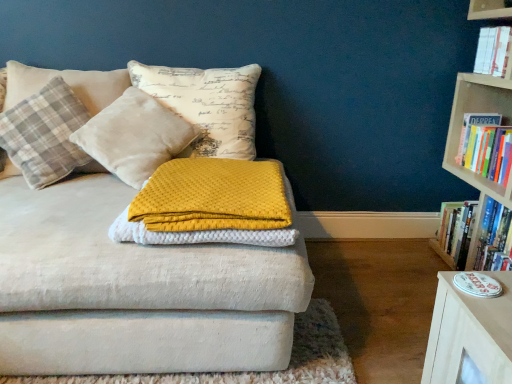
What do you see at coordinates (462, 127) in the screenshot?
I see `wooden bookcase at right` at bounding box center [462, 127].

This screenshot has width=512, height=384. What are the coordinates of `white paper book at upper right, the first book from the top` in the screenshot? It's located at (493, 50).

The image size is (512, 384). Describe the element at coordinates (493, 50) in the screenshot. I see `white paper book at upper right, the third book positioned from the bottom` at that location.

What do you see at coordinates (134, 136) in the screenshot? I see `velvet cushion at upper left, which is the 2th pillow from left to right` at bounding box center [134, 136].

You are a GUI agent. You are given a task and a screenshot of the screen. Output one action in this format:
    pyautogui.click(x=<x>, y=<y>)
    Task: Click on the plaid fabric pillow at left, which appears as the second pillow when viewed from the right
    
    Given the screenshot: What is the action you would take?
    pyautogui.click(x=45, y=134)

This screenshot has height=384, width=512. Find the location of `hardcover book at right, marked as the 2th book in a top-to-bottom arrangement`. hardcover book at right, marked as the 2th book in a top-to-bottom arrangement is located at coordinates (486, 146).

Visually, is yellow textured blanket at center positioned to the left or to the right of hardcover book at right, marked as the 2th book in a top-to-bottom arrangement?

yellow textured blanket at center is positioned on hardcover book at right, marked as the 2th book in a top-to-bottom arrangement,'s left side.

Can you confirm if yellow textured blanket at center is smaller than hardcover book at right, the second book from the bottom?

No.

Based on the photo, which object is closer to the camera, hardcover book at right, marked as the 2th book in a top-to-bottom arrangement, or yellow textured blanket at center?

yellow textured blanket at center is closer to the camera.

Considering the points (501, 156) and (199, 240), which point is in front, point (501, 156) or point (199, 240)?

Point (199, 240)

Locate an element on the screen. The height and width of the screenshot is (384, 512). the 2nd book behind the yellow textured blanket at center is located at coordinates (486, 146).

From a real-world perspective, who is located higher, hardcover book at right, marked as the 2th book in a top-to-bottom arrangement, or yellow textured blanket at center?

hardcover book at right, marked as the 2th book in a top-to-bottom arrangement, from a real-world perspective.

Considering the positions of objects yellow textured blanket at center and wooden bookcase at right in the image provided, who is more to the left, yellow textured blanket at center or wooden bookcase at right?

From the viewer's perspective, yellow textured blanket at center appears more on the left side.

Is yellow textured blanket at center facing away from wooden bookcase at right?

No, yellow textured blanket at center is not facing away from wooden bookcase at right.

Looking at this image, from the image's perspective, is yellow textured blanket at center above or below wooden bookcase at right?

yellow textured blanket at center is situated lower than wooden bookcase at right in the image.

From a real-world perspective, which is physically below, yellow textured blanket at center or wooden bookcase at right?

yellow textured blanket at center, from a real-world perspective.

Considering the sizes of white paper book at upper right, the first book from the top, and wooden bookcase at right in the image, is white paper book at upper right, the first book from the top, bigger or smaller than wooden bookcase at right?

In the image, white paper book at upper right, the first book from the top, appears to be smaller than wooden bookcase at right.

From the image's perspective, relative to wooden bookcase at right, is white paper book at upper right, the third book positioned from the bottom, above or below?

Clearly, from the image's perspective, white paper book at upper right, the third book positioned from the bottom, is above wooden bookcase at right.

Based on their positions, is white paper book at upper right, the third book positioned from the bottom, located to the left or right of wooden bookcase at right?

In the image, white paper book at upper right, the third book positioned from the bottom, appears on the right side of wooden bookcase at right.

Between white paper book at upper right, the first book from the top, and wooden bookcase at right, which one has smaller width?

white paper book at upper right, the first book from the top.

From the image's perspective, which object appears higher, velvet cushion at upper left, which is the 2th pillow from left to right, or hardcover book at right, which appears as the 1th book when ordered from the bottom?

velvet cushion at upper left, which is the 2th pillow from left to right, from the image's perspective.

Considering the sizes of objects velvet cushion at upper left, which is the 2th pillow from left to right, and hardcover book at right, which appears as the 1th book when ordered from the bottom, in the image provided, who is taller, velvet cushion at upper left, which is the 2th pillow from left to right, or hardcover book at right, which appears as the 1th book when ordered from the bottom,?

velvet cushion at upper left, which is the 2th pillow from left to right.

Would you say velvet cushion at upper left, which is the 2th pillow from left to right, is inside or outside hardcover book at right, placed as the third book when sorted from top to bottom?

velvet cushion at upper left, which is the 2th pillow from left to right, lies outside hardcover book at right, placed as the third book when sorted from top to bottom.

Based on the photo, choose the correct answer: Is plaid fabric pillow at left, which is the first pillow from left to right, inside white paper book at upper right, the first book from the top, or outside it?

plaid fabric pillow at left, which is the first pillow from left to right, lies outside white paper book at upper right, the first book from the top.

Is plaid fabric pillow at left, which appears as the second pillow when viewed from the right, positioned before white paper book at upper right, the first book from the top?

Yes, plaid fabric pillow at left, which appears as the second pillow when viewed from the right, is closer to the viewer.

From a real-world perspective, is plaid fabric pillow at left, which appears as the second pillow when viewed from the right, located beneath white paper book at upper right, the third book positioned from the bottom?

Indeed, from a real-world perspective, plaid fabric pillow at left, which appears as the second pillow when viewed from the right, is positioned beneath white paper book at upper right, the third book positioned from the bottom.

From the image's perspective, is plaid fabric pillow at left, which is the first pillow from left to right, beneath white paper book at upper right, the first book from the top?

Indeed, from the image's perspective, plaid fabric pillow at left, which is the first pillow from left to right, is shown beneath white paper book at upper right, the first book from the top.

Considering the sizes of objects wooden bookcase at right and hardcover book at right, the second book from the bottom, in the image provided, who is bigger, wooden bookcase at right or hardcover book at right, the second book from the bottom,?

wooden bookcase at right is bigger.

Considering the sizes of objects wooden bookcase at right and hardcover book at right, the second book from the bottom, in the image provided, who is taller, wooden bookcase at right or hardcover book at right, the second book from the bottom,?

wooden bookcase at right is taller.

From a real-world perspective, which object rests below the other?

In real-world perspective, hardcover book at right, the second book from the bottom, is lower.

Would you say wooden bookcase at right is to the left or to the right of hardcover book at right, the second book from the bottom, in the picture?

wooden bookcase at right is to the left of hardcover book at right, the second book from the bottom.

Locate an element on the screen. This screenshot has height=384, width=512. the 3rd book to the right of the yellow textured blanket at center, counting from the anchor's position is located at coordinates (486, 146).

Starting from the yellow textured blanket at center, which book is the 2nd one behind? Please provide its 2D coordinates.

[(486, 146)]

Considering their positions, is white paper book at upper right, the first book from the top, positioned further to plaid fabric pillow at left, which appears as the second pillow when viewed from the right, than velvet cushion at upper left, the 1th pillow positioned from the right?

white paper book at upper right, the first book from the top, lies further to plaid fabric pillow at left, which appears as the second pillow when viewed from the right, than the other object.

Estimate the real-world distances between objects in this image. Which object is closer to plaid fabric pillow at left, which appears as the second pillow when viewed from the right, white paper book at upper right, the first book from the top, or hardcover book at right, marked as the 2th book in a top-to-bottom arrangement?

hardcover book at right, marked as the 2th book in a top-to-bottom arrangement, lies closer to plaid fabric pillow at left, which appears as the second pillow when viewed from the right, than the other object.

From the image, which object appears to be farther from hardcover book at right, which appears as the 1th book when ordered from the bottom, yellow textured blanket at center or hardcover book at right, the second book from the bottom?

yellow textured blanket at center.

From the image, which object appears to be nearer to white paper book at upper right, the third book positioned from the bottom, wooden bookcase at right or yellow textured blanket at center?

wooden bookcase at right lies closer to white paper book at upper right, the third book positioned from the bottom, than the other object.

Based on their spatial positions, is white paper book at upper right, the third book positioned from the bottom, or wooden bookcase at right closer to hardcover book at right, marked as the 2th book in a top-to-bottom arrangement?

Based on the image, wooden bookcase at right appears to be nearer to hardcover book at right, marked as the 2th book in a top-to-bottom arrangement.

Estimate the real-world distances between objects in this image. Which object is further from hardcover book at right, which appears as the 1th book when ordered from the bottom, wooden bookcase at right or velvet cushion at upper left, which is the 2th pillow from left to right?

velvet cushion at upper left, which is the 2th pillow from left to right, is further to hardcover book at right, which appears as the 1th book when ordered from the bottom.

Estimate the real-world distances between objects in this image. Which object is closer to velvet cushion at upper left, which is the 2th pillow from left to right, hardcover book at right, the second book from the bottom, or white paper book at upper right, the first book from the top?

hardcover book at right, the second book from the bottom, lies closer to velvet cushion at upper left, which is the 2th pillow from left to right, than the other object.

Considering their positions, is yellow textured blanket at center positioned closer to hardcover book at right, placed as the third book when sorted from top to bottom, than plaid fabric pillow at left, which appears as the second pillow when viewed from the right?

yellow textured blanket at center.

The height and width of the screenshot is (384, 512). In order to click on blanket between plaid fabric pillow at left, which appears as the second pillow when viewed from the right, and hardcover book at right, which appears as the 1th book when ordered from the bottom, from left to right in this screenshot , I will do `click(209, 205)`.

The image size is (512, 384). I want to click on pillow situated between plaid fabric pillow at left, which appears as the second pillow when viewed from the right, and white paper book at upper right, the third book positioned from the bottom, from left to right, so click(134, 136).

At what (x,y) coordinates should I click in order to perform the action: click on blanket between velvet cushion at upper left, which is the 2th pillow from left to right, and hardcover book at right, the second book from the bottom, in the horizontal direction. Please return your answer as a coordinate pair (x, y). Image resolution: width=512 pixels, height=384 pixels. Looking at the image, I should click on (209, 205).

The height and width of the screenshot is (384, 512). Find the location of `blanket between velvet cushion at upper left, the 1th pillow positioned from the right, and white paper book at upper right, the third book positioned from the bottom`. blanket between velvet cushion at upper left, the 1th pillow positioned from the right, and white paper book at upper right, the third book positioned from the bottom is located at coordinates point(209,205).